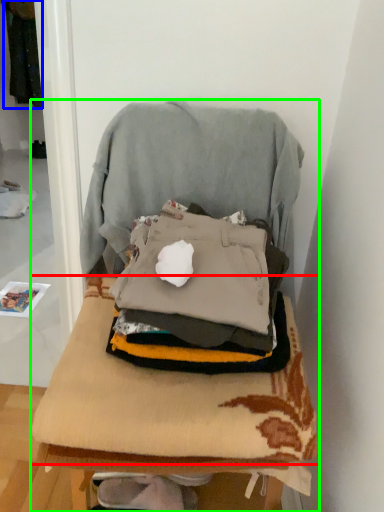
Question: Considering the real-world distances, which object is farthest from blanket (highlighted by a red box)? clothing (highlighted by a blue box) or furniture (highlighted by a green box)?

Choices:
 (A) clothing
 (B) furniture

Answer: (A)